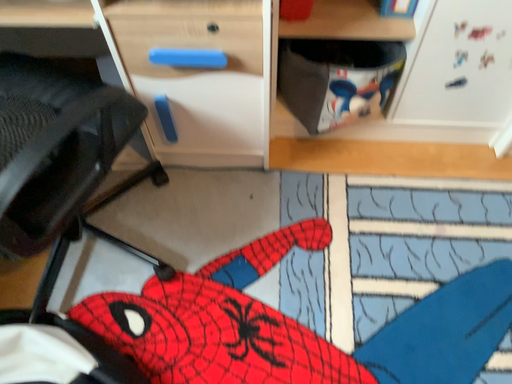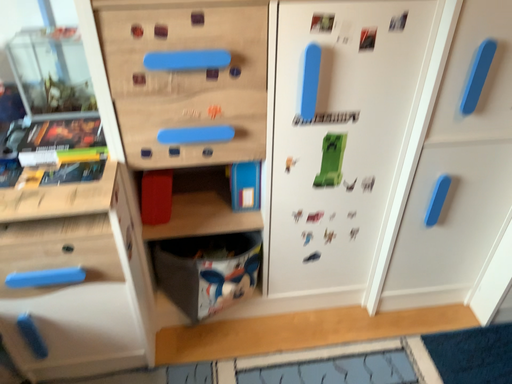
Question: How did the camera likely rotate when shooting the video?

Choices:
 (A) rotated downward
 (B) rotated upward

Answer: (B)